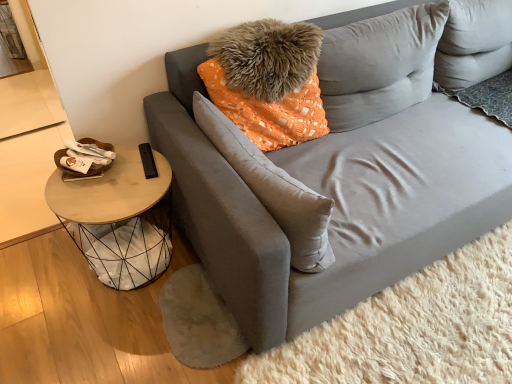
Question: Which is correct: suede gray pillow at center, which appears as the second pillow when viewed from the right, is inside woodenmaterial/texture side table at left, or outside of it?

Choices:
 (A) outside
 (B) inside

Answer: (A)

Question: From the image's perspective, is suede gray pillow at center, which appears as the second pillow when viewed from the right, above or below woodenmaterial/texture side table at left?

Choices:
 (A) above
 (B) below

Answer: (A)

Question: Which is farther from the velvety gray pillow at upper right, arranged as the 1th pillow when viewed from the right?

Choices:
 (A) woodenmaterial/texture side table at left
 (B) suede gray pillow at center, marked as the 1th pillow in a left-to-right arrangement
 (C) velvet gray couch at center

Answer: (A)

Question: Considering the real-world distances, which object is farthest from the velvet gray couch at center?

Choices:
 (A) woodenmaterial/texture side table at left
 (B) suede gray pillow at center, marked as the 1th pillow in a left-to-right arrangement
 (C) velvety gray pillow at upper right, placed as the 2th pillow when sorted from left to right

Answer: (A)